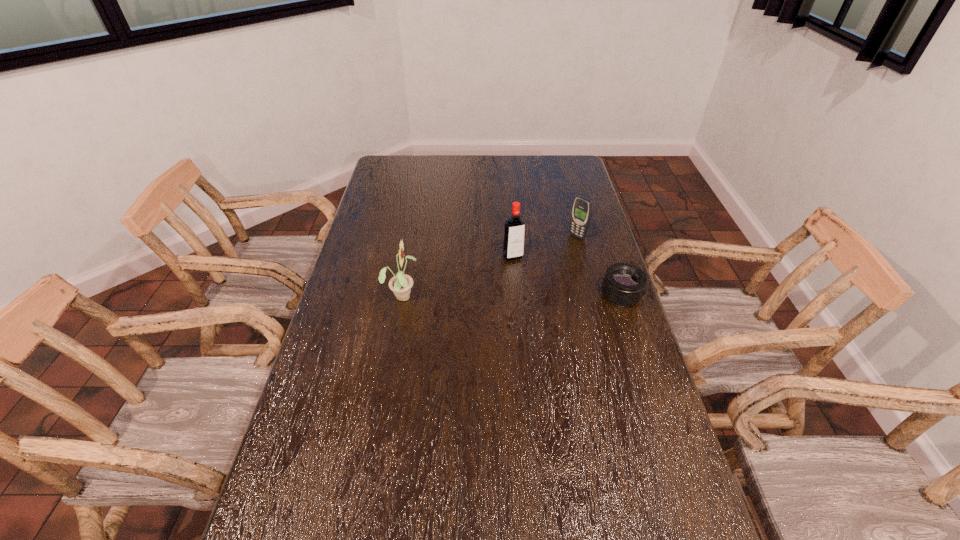
This screenshot has width=960, height=540. What are the coordinates of `object identified as the third closest to the sunflower` in the screenshot? It's located at (624, 284).

Find the location of a particular element. This screenshot has height=540, width=960. object that is the third closest to the vodka is located at coordinates (401, 284).

Identify the location of free point that satisfies the following two spatial constraints: 1. on the front side of the telephoto lens; 2. on the side of the second farthest object with brand markings and control switches. The width and height of the screenshot is (960, 540). (516, 295).

Where is `free location that satisfies the following two spatial constraints: 1. on the front side of the shortest object; 2. on the side of the third tallest object with brand markings and control switches`? free location that satisfies the following two spatial constraints: 1. on the front side of the shortest object; 2. on the side of the third tallest object with brand markings and control switches is located at coordinates (x=592, y=295).

Identify the location of vacant region that satisfies the following two spatial constraints: 1. on the front side of the shortest object; 2. on the side of the cellular telephone with brand markings and control switches. The image size is (960, 540). (592, 295).

What are the coordinates of `free space that satisfies the following two spatial constraints: 1. on the back side of the vodka; 2. on the right side of the third tallest object` in the screenshot? It's located at (512, 236).